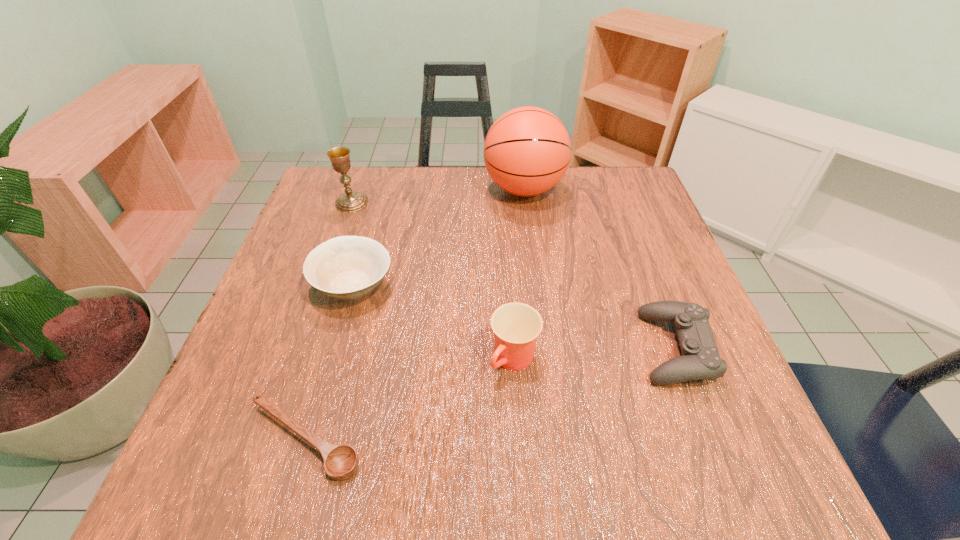
Point out which object is positioned as the third nearest to the chalice. Please provide its 2D coordinates. Your answer should be formatted as a tuple, i.e. [(x, y)], where the tuple contains the x and y coordinates of a point satisfying the conditions above.

[(516, 326)]

Where is `the second closest object to the third tallest object`? the second closest object to the third tallest object is located at coordinates (341, 462).

You are a GUI agent. You are given a task and a screenshot of the screen. Output one action in this format:
    pyautogui.click(x=<x>, y=<y>)
    Task: Click on the free location that satisfies the following two spatial constraints: 1. on the front side of the bowl; 2. on the right side of the cup
    The width and height of the screenshot is (960, 540).
    Given the screenshot: What is the action you would take?
    pyautogui.click(x=333, y=360)

I want to click on blank space that satisfies the following two spatial constraints: 1. on the back side of the tallest object; 2. on the left side of the chalice, so click(x=356, y=189).